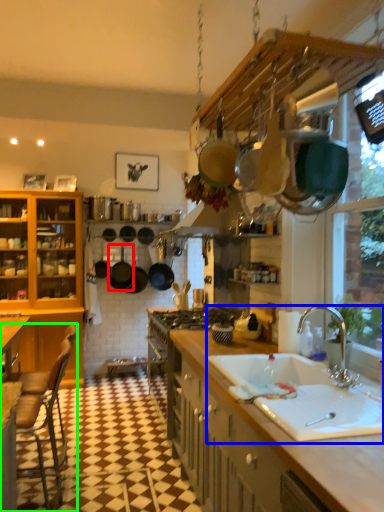
Question: Considering the real-world distances, which object is closest to frying pan (highlighted by a red box)? sink (highlighted by a blue box) or chair (highlighted by a green box).

Choices:
 (A) sink
 (B) chair

Answer: (B)